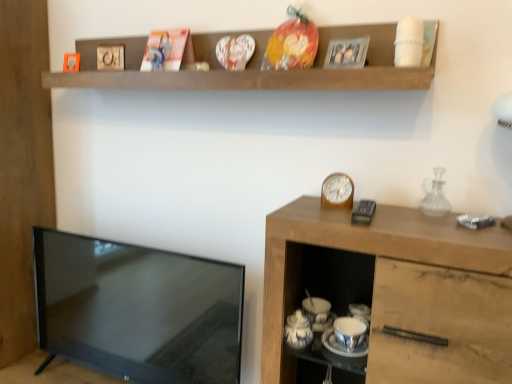
Image resolution: width=512 pixels, height=384 pixels. I want to click on brown wooden shelf at upper center, so click(251, 66).

This screenshot has height=384, width=512. Describe the element at coordinates (337, 192) in the screenshot. I see `wooden clock at right` at that location.

Where is `wooden clock at right`? This screenshot has height=384, width=512. wooden clock at right is located at coordinates (337, 192).

How much space does matte wooden picture frame at upper left, which appears as the 4th picture frame when viewed from the front, occupy vertically?

matte wooden picture frame at upper left, which appears as the 4th picture frame when viewed from the front, is 2.99 inches in height.

The width and height of the screenshot is (512, 384). Describe the element at coordinates (346, 53) in the screenshot. I see `metallic silver photo frame at upper center, positioned as the fourth picture frame in back-to-front order` at that location.

Locate an element on the screen. Image resolution: width=512 pixels, height=384 pixels. white glossy saucer at lower center is located at coordinates (343, 346).

At what (x,y) coordinates should I click in order to perform the action: click on matte cardboard picture frame at upper center, placed as the 3th picture frame when sorted from left to right. Please return your answer as a coordinate pair (x, y). This screenshot has width=512, height=384. Looking at the image, I should click on (167, 50).

Image resolution: width=512 pixels, height=384 pixels. Find the location of `brown wooden shelf at upper center`. brown wooden shelf at upper center is located at coordinates (251, 66).

Find the location of a particular element. picture frame that is the 1st object directly below the metallic gold picture frame at upper center, the third picture frame positioned from the right (from a real-world perspective) is located at coordinates (346, 53).

From the image's perspective, does metallic gold picture frame at upper center, the third picture frame positioned from the right, appear lower than metallic silver photo frame at upper center, positioned as the fourth picture frame in back-to-front order?

No.

Between metallic gold picture frame at upper center, the third picture frame positioned from the right, and metallic silver photo frame at upper center, which is counted as the 1th picture frame, starting from the front, which one appears on the right side from the viewer's perspective?

Positioned to the right is metallic silver photo frame at upper center, which is counted as the 1th picture frame, starting from the front.

Is white glossy saucer at lower center oriented towards wooden clock at right?

No, white glossy saucer at lower center is not turned towards wooden clock at right.

Does white glossy saucer at lower center have a greater width compared to wooden clock at right?

Yes, white glossy saucer at lower center is wider than wooden clock at right.

Is white glossy saucer at lower center with wooden clock at right?

No, white glossy saucer at lower center is not with wooden clock at right.

The width and height of the screenshot is (512, 384). What are the coordinates of `clock on the left of white glossy saucer at lower center` in the screenshot? It's located at (337, 192).

Does wooden cabinet at right appear on the right side of transparent glass carafe at right?

No.

Considering the sizes of objects wooden cabinet at right and transparent glass carafe at right in the image provided, who is taller, wooden cabinet at right or transparent glass carafe at right?

wooden cabinet at right is taller.

From a real-world perspective, who is located higher, wooden cabinet at right or transparent glass carafe at right?

From a 3D spatial view, transparent glass carafe at right is above.

Considering the relative sizes of wooden cabinet at right and transparent glass carafe at right in the image provided, is wooden cabinet at right wider than transparent glass carafe at right?

Indeed, wooden cabinet at right has a greater width compared to transparent glass carafe at right.

Considering the sizes of objects wooden clock at right and metallic silver photo frame at upper center, which is counted as the 1th picture frame, starting from the front, in the image provided, who is thinner, wooden clock at right or metallic silver photo frame at upper center, which is counted as the 1th picture frame, starting from the front,?

wooden clock at right is thinner.

Are wooden clock at right and metallic silver photo frame at upper center, which is counted as the 1th picture frame, starting from the front, far apart?

That's not correct — wooden clock at right is a little close to metallic silver photo frame at upper center, which is counted as the 1th picture frame, starting from the front.

Would you say wooden clock at right contains metallic silver photo frame at upper center, positioned as the fourth picture frame in back-to-front order?

No, metallic silver photo frame at upper center, positioned as the fourth picture frame in back-to-front order, is not surrounded by wooden clock at right.

Is wooden clock at right behind metallic silver photo frame at upper center, which is the first picture frame in right-to-left order?

Yes, the depth of wooden clock at right is greater than that of metallic silver photo frame at upper center, which is the first picture frame in right-to-left order.

From the image's perspective, starting from the brown wooden shelf at upper center, which picture frame is the 3rd one above? Please provide its 2D coordinates.

[(167, 50)]

Between brown wooden shelf at upper center and matte cardboard picture frame at upper center, the 2th picture frame when ordered from right to left, which one is positioned in front?

brown wooden shelf at upper center is closer to the camera.

Is brown wooden shelf at upper center wider than matte cardboard picture frame at upper center, which appears as the second picture frame when viewed from the front?

Yes, brown wooden shelf at upper center is wider than matte cardboard picture frame at upper center, which appears as the second picture frame when viewed from the front.

Consider the image. Is brown wooden shelf at upper center situated inside matte cardboard picture frame at upper center, which is the 3th picture frame from back to front, or outside?

brown wooden shelf at upper center is spatially situated outside matte cardboard picture frame at upper center, which is the 3th picture frame from back to front.

From a real-world perspective, which object rests below the other?

In real-world perspective, matte black tv at left is lower.

Can you confirm if matte black tv at left is shorter than white glossy saucer at lower center?

No, matte black tv at left is not shorter than white glossy saucer at lower center.

Is matte black tv at left facing away from white glossy saucer at lower center?

No, matte black tv at left is not facing the opposite direction of white glossy saucer at lower center.

Is matte black tv at left next to white glossy saucer at lower center?

There is a gap between matte black tv at left and white glossy saucer at lower center.

Based on the photo, between white glossy saucer at lower center and metallic gold picture frame at upper center, which is the 2th picture frame in left-to-right order, which one has smaller width?

metallic gold picture frame at upper center, which is the 2th picture frame in left-to-right order.

Is white glossy saucer at lower center turned away from metallic gold picture frame at upper center, which is the 2th picture frame in left-to-right order?

No, metallic gold picture frame at upper center, which is the 2th picture frame in left-to-right order, is not at the back of white glossy saucer at lower center.

Can you tell me how much white glossy saucer at lower center and metallic gold picture frame at upper center, which is the 2th picture frame in left-to-right order, differ in facing direction?

The angle between the facing direction of white glossy saucer at lower center and the facing direction of metallic gold picture frame at upper center, which is the 2th picture frame in left-to-right order, is 7.91 degrees.

The image size is (512, 384). I want to click on the 3rd picture frame located above the white glossy saucer at lower center (from a real-world perspective), so click(110, 57).

Where is `the 1st picture frame located above the metallic silver photo frame at upper center, which appears as the fourth picture frame when viewed from the left (from a real-world perspective)`? Image resolution: width=512 pixels, height=384 pixels. the 1st picture frame located above the metallic silver photo frame at upper center, which appears as the fourth picture frame when viewed from the left (from a real-world perspective) is located at coordinates (110, 57).

Locate an element on the screen. The height and width of the screenshot is (384, 512). clock lying on the left of white glossy saucer at lower center is located at coordinates (337, 192).

Based on their spatial positions, is brown wooden shelf at upper center or metallic gold picture frame at upper center, which is the 2th picture frame in left-to-right order, closer to metallic silver photo frame at upper center, which is the first picture frame in right-to-left order?

brown wooden shelf at upper center is positioned closer to the anchor metallic silver photo frame at upper center, which is the first picture frame in right-to-left order.

Considering their positions, is brown wooden shelf at upper center positioned closer to wooden cabinet at right than metallic silver photo frame at upper center, which is counted as the 1th picture frame, starting from the front?

brown wooden shelf at upper center lies closer to wooden cabinet at right than the other object.

When comparing their distances from matte black tv at left, does white glossy saucer at lower center or metallic gold picture frame at upper center, the third picture frame positioned from the right, seem closer?

Based on the image, white glossy saucer at lower center appears to be nearer to matte black tv at left.

Looking at the image, which one is located closer to matte cardboard picture frame at upper center, which is the 3th picture frame from back to front, transparent glass carafe at right or wooden cabinet at right?

wooden cabinet at right lies closer to matte cardboard picture frame at upper center, which is the 3th picture frame from back to front, than the other object.

When comparing their distances from metallic silver photo frame at upper center, which appears as the fourth picture frame when viewed from the left, does brown wooden shelf at upper center or white glossy saucer at lower center seem closer?

brown wooden shelf at upper center lies closer to metallic silver photo frame at upper center, which appears as the fourth picture frame when viewed from the left, than the other object.

Based on their spatial positions, is wooden clock at right or white glossy saucer at lower center further from metallic gold picture frame at upper center, the third picture frame positioned from the right?

white glossy saucer at lower center is further to metallic gold picture frame at upper center, the third picture frame positioned from the right.

From the image, which object appears to be farther from matte wooden picture frame at upper left, which appears as the 4th picture frame when viewed from the front, transparent glass carafe at right or matte black tv at left?

Based on the image, transparent glass carafe at right appears to be further to matte wooden picture frame at upper left, which appears as the 4th picture frame when viewed from the front.

Looking at the image, which one is located further to wooden clock at right, matte black tv at left or transparent glass carafe at right?

The object further to wooden clock at right is matte black tv at left.

Where is `clock that lies between metallic silver photo frame at upper center, positioned as the fourth picture frame in back-to-front order, and wooden cabinet at right from top to bottom`? The height and width of the screenshot is (384, 512). clock that lies between metallic silver photo frame at upper center, positioned as the fourth picture frame in back-to-front order, and wooden cabinet at right from top to bottom is located at coordinates (337, 192).

Identify the location of cabinetry between matte cardboard picture frame at upper center, which appears as the second picture frame when viewed from the front, and white glossy saucer at lower center vertically. (393, 290).

Find the location of a particular element. clock situated between matte black tv at left and wooden cabinet at right from left to right is located at coordinates (337, 192).

Identify the location of side between matte cardboard picture frame at upper center, which appears as the second picture frame when viewed from the front, and matte black tv at left in the up-down direction. Image resolution: width=512 pixels, height=384 pixels. (23, 167).